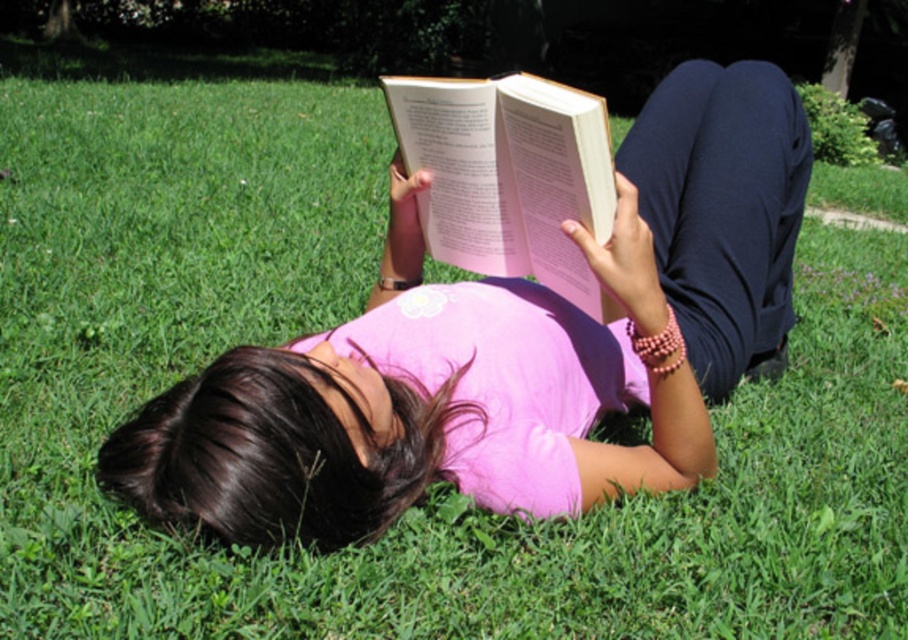
Question: Does pink matte shirt at center lie behind hardcover book at center?

Choices:
 (A) no
 (B) yes

Answer: (A)

Question: Which of the following is the closest to the observer?

Choices:
 (A) (344, 444)
 (B) (462, 212)

Answer: (A)

Question: Which object appears closest to the camera in this image?

Choices:
 (A) hardcover book at center
 (B) pink matte shirt at center

Answer: (B)

Question: From the image, what is the correct spatial relationship of pink matte shirt at center in relation to hardcover book at center?

Choices:
 (A) left
 (B) right

Answer: (B)

Question: In this image, where is pink matte shirt at center located relative to hardcover book at center?

Choices:
 (A) above
 (B) below

Answer: (B)

Question: Which object is farther from the camera taking this photo?

Choices:
 (A) hardcover book at center
 (B) pink matte shirt at center

Answer: (A)